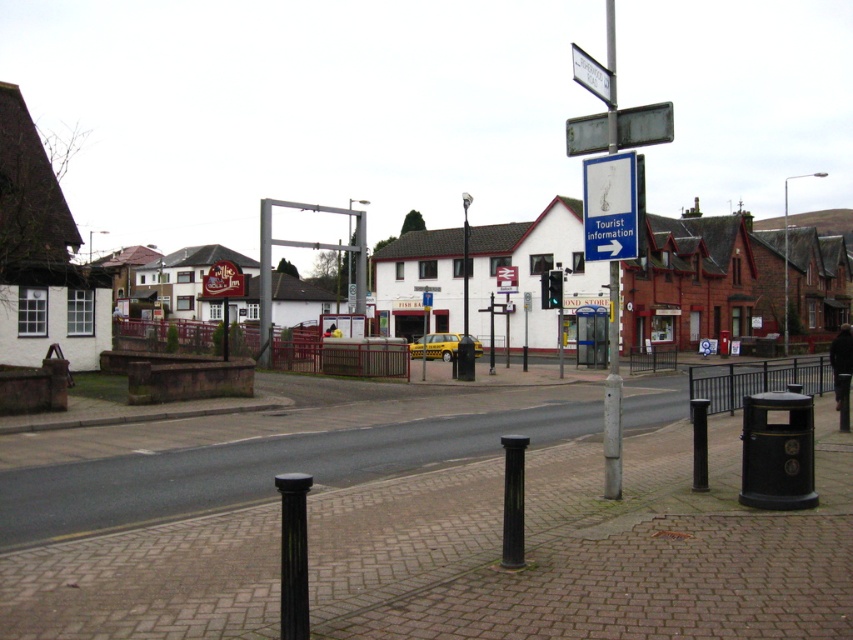
In the scene shown: Is silver metallic pole at center taller than white plastic street sign at upper center?

Yes, silver metallic pole at center is taller than white plastic street sign at upper center.

Between point (607, 452) and point (601, 88), which one is positioned behind?

Point (601, 88)

Where is `silver metallic pole at center`? This screenshot has height=640, width=853. silver metallic pole at center is located at coordinates (612, 396).

What do you see at coordinates (701, 280) in the screenshot? I see `white painted building at center` at bounding box center [701, 280].

From the picture: Is white painted building at center wider than white plastic street sign at upper center?

Indeed, white painted building at center has a greater width compared to white plastic street sign at upper center.

Locate an element on the screen. white painted building at center is located at coordinates (701, 280).

Can you confirm if metallic street sign at upper center is positioned below white plastic street sign at upper center?

Correct, metallic street sign at upper center is located below white plastic street sign at upper center.

Can you confirm if metallic street sign at upper center is bigger than white plastic street sign at upper center?

Incorrect, metallic street sign at upper center is not larger than white plastic street sign at upper center.

Which is behind, point (595, 134) or point (605, 68)?

The point (595, 134) is more distant.

At what (x,y) coordinates should I click in order to perform the action: click on metallic street sign at upper center. Please return your answer as a coordinate pair (x, y). Looking at the image, I should click on (619, 129).